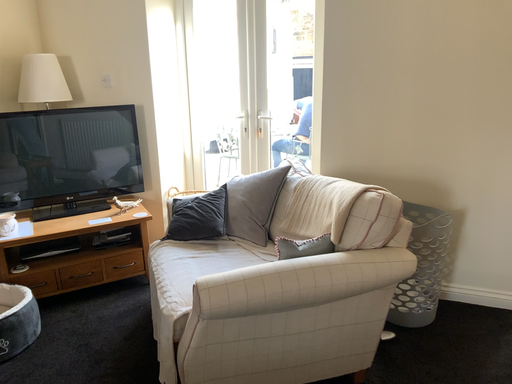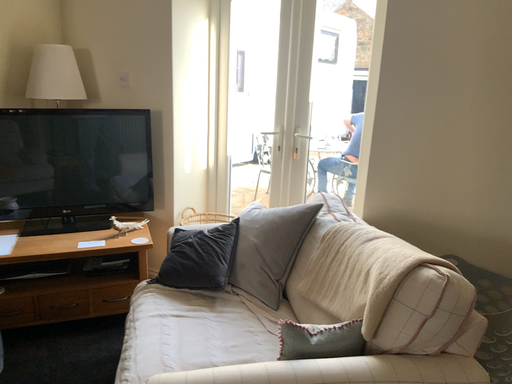
Question: How did the camera likely rotate when shooting the video?

Choices:
 (A) rotated left
 (B) rotated right

Answer: (A)